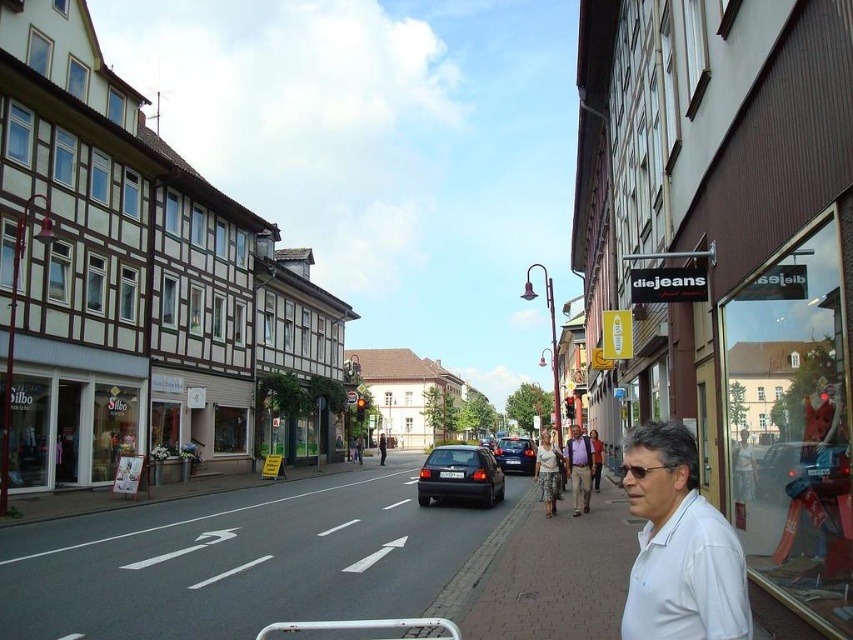
You are a pedestrian standing on the street and see the shiny black hatchback at center and the white cotton blouse at center. Which object is closer to you?

The shiny black hatchback at center is closer to you because the white cotton blouse at center is behind it.

You are a delivery person who needs to deliver a package to the white matte shirt at center. You are currently standing at the point marked by the coordinates point (679,545). Is the white matte shirt at center in front of you or behind you?

The point marked by the coordinates point (679,545) is where you are currently standing, so the white matte shirt at center is in front of you.